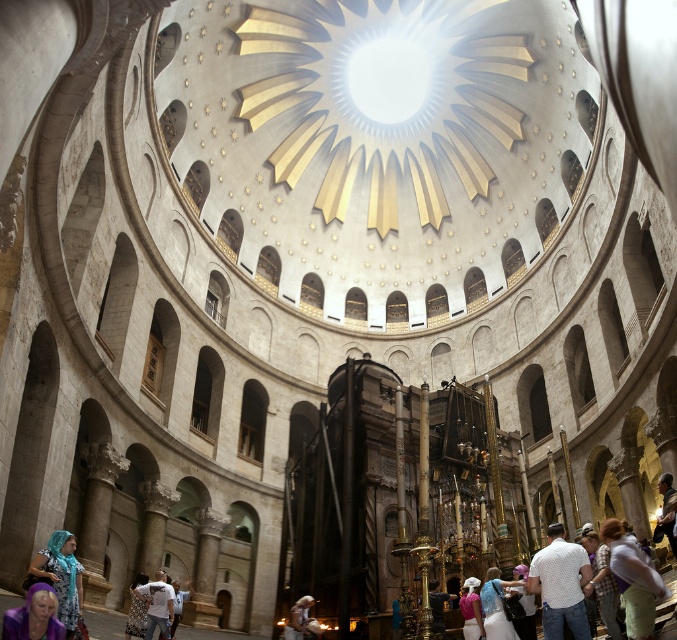
You are standing in the grand circular structure and want to pick up the blue satin dress at lower center and the white cotton shirt at lower center. Which one can you reach without moving closer to the structure?

The blue satin dress at lower center is closer to the viewer than the white cotton shirt at lower center, so you can reach the blue satin dress at lower center without moving closer.

From the picture: You are a fashion designer observing the grand circular structure. You notice the blue satin dress at lower center and the white cotton shirt at lower center. Which clothing item is narrower in width?

The blue satin dress at lower center is thinner than the white cotton shirt at lower center, making it narrower in width.